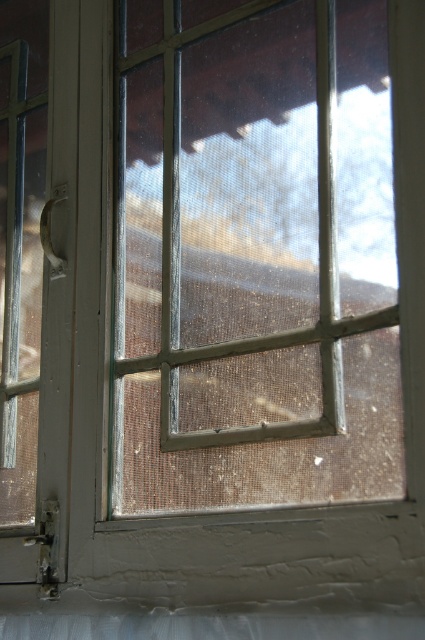
Question: Which object is farther from the camera taking this photo?

Choices:
 (A) white textured curtain at bottom
 (B) clear glass window at center

Answer: (B)

Question: Is clear glass window at center to the left of white textured curtain at bottom from the viewer's perspective?

Choices:
 (A) no
 (B) yes

Answer: (A)

Question: Which point appears closest to the camera in this image?

Choices:
 (A) (359, 481)
 (B) (104, 632)

Answer: (A)

Question: Does clear glass window at center have a larger size compared to white textured curtain at bottom?

Choices:
 (A) no
 (B) yes

Answer: (B)

Question: Is clear glass window at center above white textured curtain at bottom?

Choices:
 (A) no
 (B) yes

Answer: (B)

Question: Which point is farther from the camera taking this photo?

Choices:
 (A) (101, 628)
 (B) (224, 294)

Answer: (B)